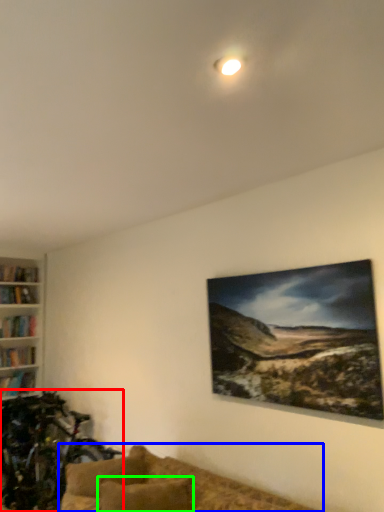
Question: Considering the real-world distances, which object is farthest from mountain bike (highlighted by a red box)? studio couch (highlighted by a blue box) or pillow (highlighted by a green box)?

Choices:
 (A) studio couch
 (B) pillow

Answer: (B)